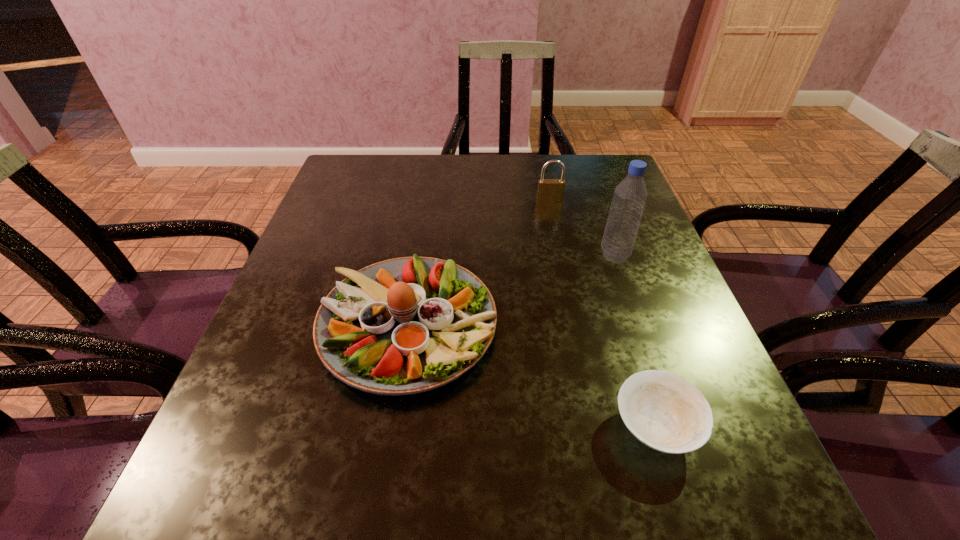
Identify the location of object present at the near edge. The height and width of the screenshot is (540, 960). (665, 412).

At what (x,y) coordinates should I click in order to perform the action: click on object at the left edge. Please return your answer as a coordinate pair (x, y). This screenshot has width=960, height=540. Looking at the image, I should click on (403, 326).

The image size is (960, 540). In order to click on bottle located in the right edge section of the desktop in this screenshot , I will do `click(629, 198)`.

This screenshot has width=960, height=540. Find the location of `bowl positioned at the right edge`. bowl positioned at the right edge is located at coordinates (665, 412).

Identify the location of object located at the near right corner. (665, 412).

Image resolution: width=960 pixels, height=540 pixels. I want to click on vacant area at the far edge, so click(531, 180).

This screenshot has width=960, height=540. In the image, there is a desktop. Find the location of `vacant space at the near edge`. vacant space at the near edge is located at coordinates (551, 533).

The width and height of the screenshot is (960, 540). I want to click on free space at the left edge, so click(x=365, y=245).

Image resolution: width=960 pixels, height=540 pixels. In the image, there is a desktop. Find the location of `vacant space at the right edge`. vacant space at the right edge is located at coordinates (707, 393).

In the image, there is a desktop. Where is `free space at the far left corner`? The height and width of the screenshot is (540, 960). free space at the far left corner is located at coordinates (361, 178).